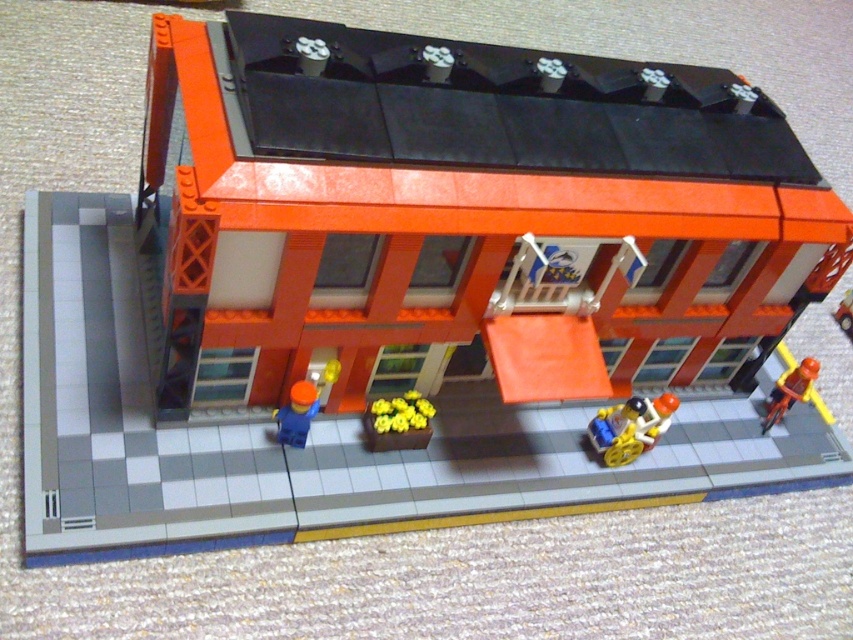
Question: Can you confirm if translucent yellow plastic cart at lower center is positioned below brick red car at right?

Choices:
 (A) no
 (B) yes

Answer: (B)

Question: Based on their relative distances, which object is nearer to the translucent yellow plastic cart at lower center?

Choices:
 (A) yellow matte flowers at center
 (B) orange matte bicycle at right
 (C) blue matte figure at center

Answer: (B)

Question: In this image, where is yellow matte flowers at center located relative to blue matte figure at center?

Choices:
 (A) left
 (B) right

Answer: (B)

Question: Which point is closer to the camera taking this photo?

Choices:
 (A) (816, 372)
 (B) (297, 429)

Answer: (B)

Question: Estimate the real-world distances between objects in this image. Which object is closer to the translucent yellow plastic cart at lower center?

Choices:
 (A) orange matte bicycle at right
 (B) yellow matte flowers at center
 (C) brick red car at right

Answer: (A)

Question: Is blue matte figure at center positioned in front of orange matte bicycle at right?

Choices:
 (A) yes
 (B) no

Answer: (A)